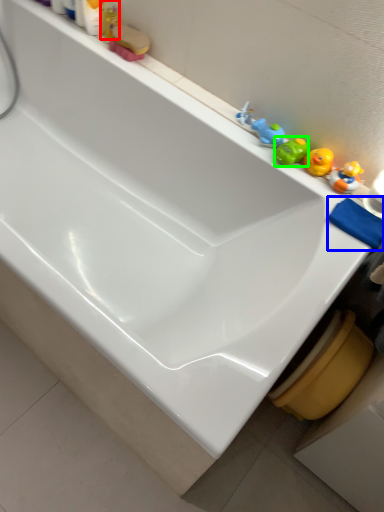
Question: Considering the real-world distances, which object is closest to toiletry (highlighted by a red box)? bath towel (highlighted by a blue box) or toy (highlighted by a green box).

Choices:
 (A) bath towel
 (B) toy

Answer: (B)